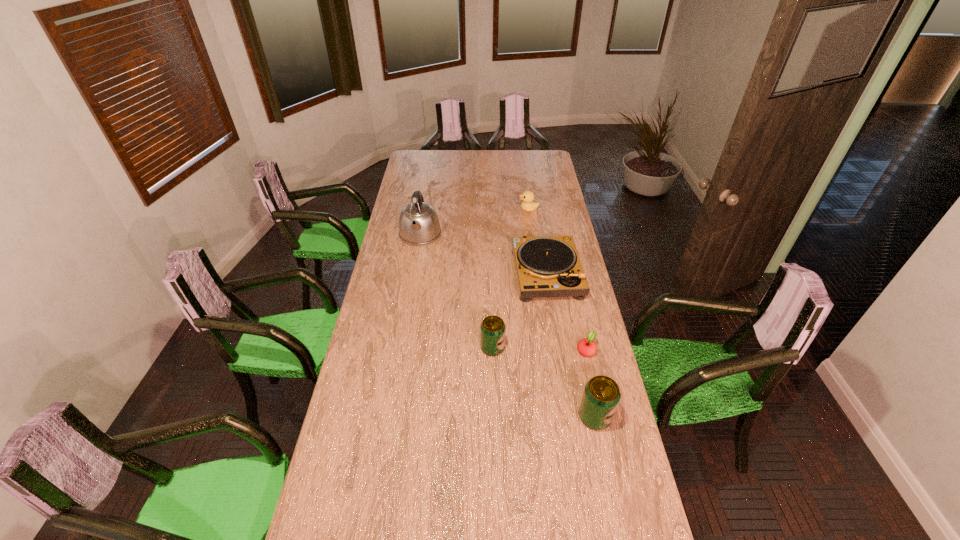
Find the location of a particular element. the third tallest object is located at coordinates (492, 330).

Identify the location of the farther beer can. This screenshot has width=960, height=540. (492, 330).

At what (x,y) coordinates should I click in order to perform the action: click on the nearest object. Please return your answer as a coordinate pair (x, y). Looking at the image, I should click on (601, 396).

At what (x,y) coordinates should I click in order to perform the action: click on the right beer can. Please return your answer as a coordinate pair (x, y). This screenshot has height=540, width=960. Looking at the image, I should click on (601, 396).

In order to click on record player in this screenshot , I will do `click(546, 266)`.

Identify the location of the farthest object. (528, 205).

The height and width of the screenshot is (540, 960). I want to click on the leftmost object, so click(x=419, y=224).

Find the location of a particular element. kettle is located at coordinates [419, 224].

Locate an element on the screen. Image resolution: width=960 pixels, height=540 pixels. the shortest object is located at coordinates (586, 347).

At what (x,y) coordinates should I click in order to perform the action: click on vacant space located on the back of the fifth object from right to left. Please return your answer as a coordinate pair (x, y). This screenshot has width=960, height=540. Looking at the image, I should click on (492, 318).